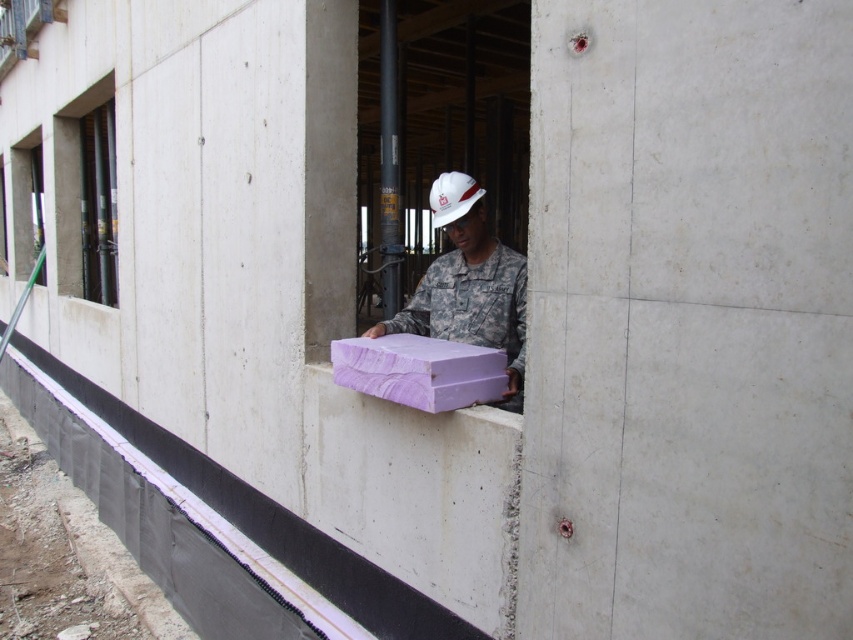
Does purple matte foam at center appear on the left side of purple wood at center?

In fact, purple matte foam at center is to the right of purple wood at center.

Is point (450, 198) positioned behind point (378, 353)?

That is True.

Which is in front, point (396, 316) or point (410, 380)?

Point (410, 380) is in front.

You are a GUI agent. You are given a task and a screenshot of the screen. Output one action in this format:
    pyautogui.click(x=<x>, y=<y>)
    Task: Click on the purple matte foam at center
    This screenshot has height=640, width=853.
    Given the screenshot: What is the action you would take?
    pyautogui.click(x=469, y=284)

Locate an element on the screen. This screenshot has width=853, height=640. purple matte foam at center is located at coordinates (469, 284).

Is purple matte foam at center bigger than clear glass window at upper left?

Incorrect, purple matte foam at center is not larger than clear glass window at upper left.

Identify the location of purple matte foam at center. (469, 284).

Find the location of a particular element. Image resolution: width=853 pixels, height=640 pixels. purple matte foam at center is located at coordinates (469, 284).

Is purple matte foam at center below black glass window at upper left?

Indeed, purple matte foam at center is positioned under black glass window at upper left.

Is purple matte foam at center to the left of black glass window at upper left from the viewer's perspective?

Incorrect, purple matte foam at center is not on the left side of black glass window at upper left.

Does point (451, 333) come behind point (56, 200)?

No, it is in front of (56, 200).

Locate an element on the screen. The height and width of the screenshot is (640, 853). purple matte foam at center is located at coordinates (469, 284).